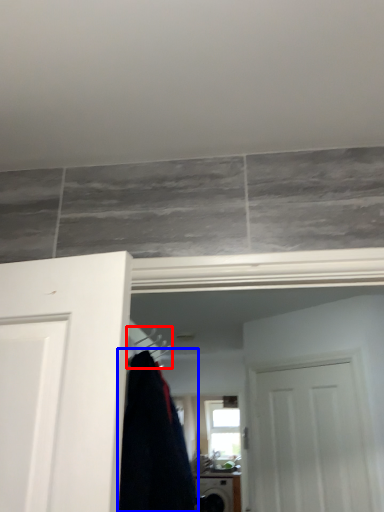
Question: Which of the following is the closest to the observer, hanger (highlighted by a red box) or clothing (highlighted by a blue box)?

Choices:
 (A) hanger
 (B) clothing

Answer: (B)